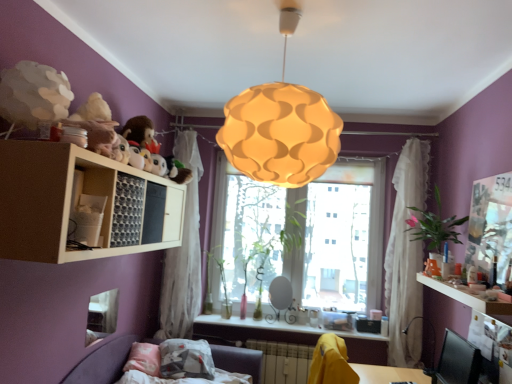
Question: Is green leafy plant at right, placed as the 4th plant when sorted from left to right, closer to the viewer compared to white sheer curtain at right, which is the 1th curtain from right to left?

Choices:
 (A) yes
 (B) no

Answer: (A)

Question: Can you see green leafy plant at right, the fourth plant when ordered from back to front, touching white sheer curtain at right, placed as the 2th curtain when sorted from left to right?

Choices:
 (A) no
 (B) yes

Answer: (A)

Question: Is green leafy plant at right, the fourth plant when ordered from back to front, further to the viewer compared to white sheer curtain at right, placed as the 2th curtain when sorted from left to right?

Choices:
 (A) yes
 (B) no

Answer: (B)

Question: From a real-world perspective, does green leafy plant at right, placed as the 1th plant when sorted from front to back, stand above white sheer curtain at right, which is the 1th curtain from right to left?

Choices:
 (A) no
 (B) yes

Answer: (B)

Question: Is green leafy plant at right, the 1th plant in the right-to-left sequence, not within white sheer curtain at right, placed as the 2th curtain when sorted from left to right?

Choices:
 (A) no
 (B) yes

Answer: (B)

Question: Is green leafy plant at right, the 1th plant in the right-to-left sequence, shorter than white sheer curtain at right, which is the 1th curtain from right to left?

Choices:
 (A) no
 (B) yes

Answer: (B)

Question: From a real-world perspective, does yellow fabric swivel chair at lower center sit lower than metallic silver table lamp at lower right?

Choices:
 (A) no
 (B) yes

Answer: (B)

Question: Is yellow fabric swivel chair at lower center oriented towards metallic silver table lamp at lower right?

Choices:
 (A) yes
 (B) no

Answer: (A)

Question: Can you confirm if yellow fabric swivel chair at lower center is positioned to the left of metallic silver table lamp at lower right?

Choices:
 (A) yes
 (B) no

Answer: (A)

Question: Is yellow fabric swivel chair at lower center taller than metallic silver table lamp at lower right?

Choices:
 (A) no
 (B) yes

Answer: (B)

Question: Is yellow fabric swivel chair at lower center positioned far away from metallic silver table lamp at lower right?

Choices:
 (A) yes
 (B) no

Answer: (B)

Question: Is metallic silver table lamp at lower right inside yellow fabric swivel chair at lower center?

Choices:
 (A) yes
 (B) no

Answer: (B)

Question: Considering the relative sizes of metallic silver table lamp at lower right and white sheer curtain at left, the second curtain viewed from the right, in the image provided, is metallic silver table lamp at lower right thinner than white sheer curtain at left, the second curtain viewed from the right,?

Choices:
 (A) no
 (B) yes

Answer: (A)